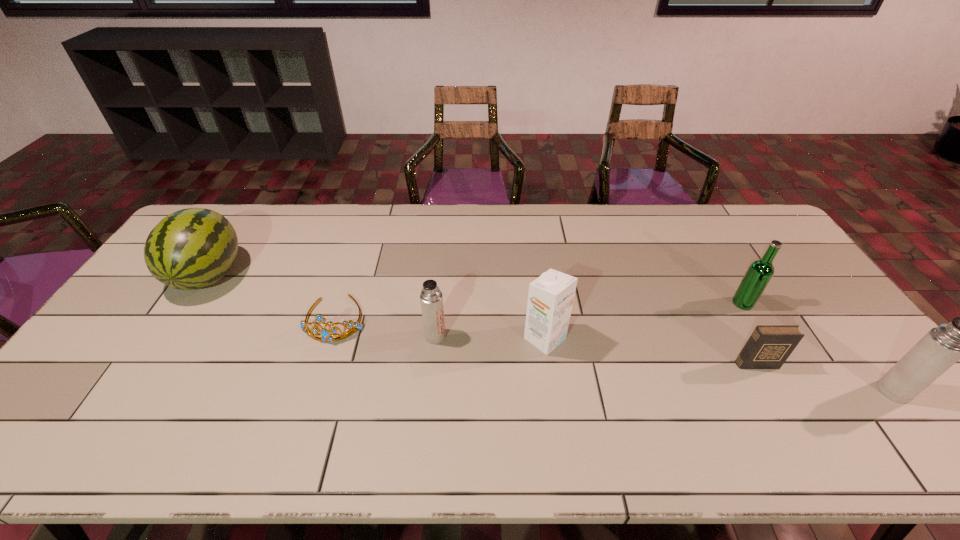
Identify the location of the second object from left to right. (326, 334).

Find the location of a particular element. vacant space situated 0.320m on the left of the third object from left to right is located at coordinates (309, 336).

Identify the location of free point located on the back of the nearer thermos bottle. The width and height of the screenshot is (960, 540). (872, 362).

Locate an element on the screen. free spot located 0.110m at the stem end of the watermelon is located at coordinates (169, 336).

Image resolution: width=960 pixels, height=540 pixels. What are the coordinates of `free spot located 0.110m on the left of the beer bottle` in the screenshot? It's located at (695, 303).

This screenshot has height=540, width=960. In order to click on free spot located on the front cover of the second shortest object in this screenshot , I will do `click(770, 389)`.

At what (x,y) coordinates should I click in order to perform the action: click on vacant region located 0.070m on the left of the fourth object from right to left. Please return your answer as a coordinate pair (x, y). This screenshot has height=540, width=960. Looking at the image, I should click on (498, 339).

The width and height of the screenshot is (960, 540). Identify the location of free spot located 0.120m on the front-facing side of the sixth object from right to left. (316, 381).

Where is `object at the near edge`? Image resolution: width=960 pixels, height=540 pixels. object at the near edge is located at coordinates (942, 346).

Where is `object at the left edge`? The width and height of the screenshot is (960, 540). object at the left edge is located at coordinates (193, 248).